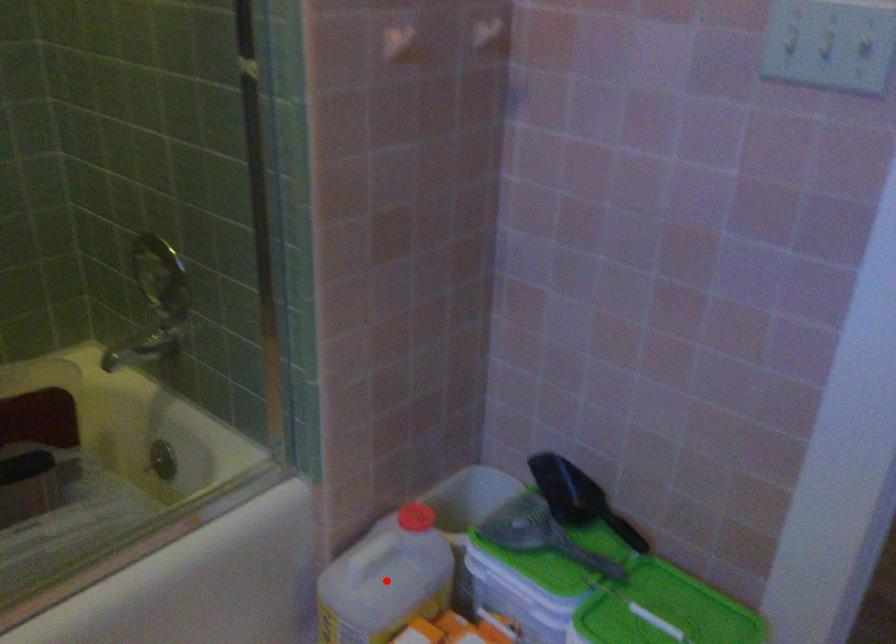
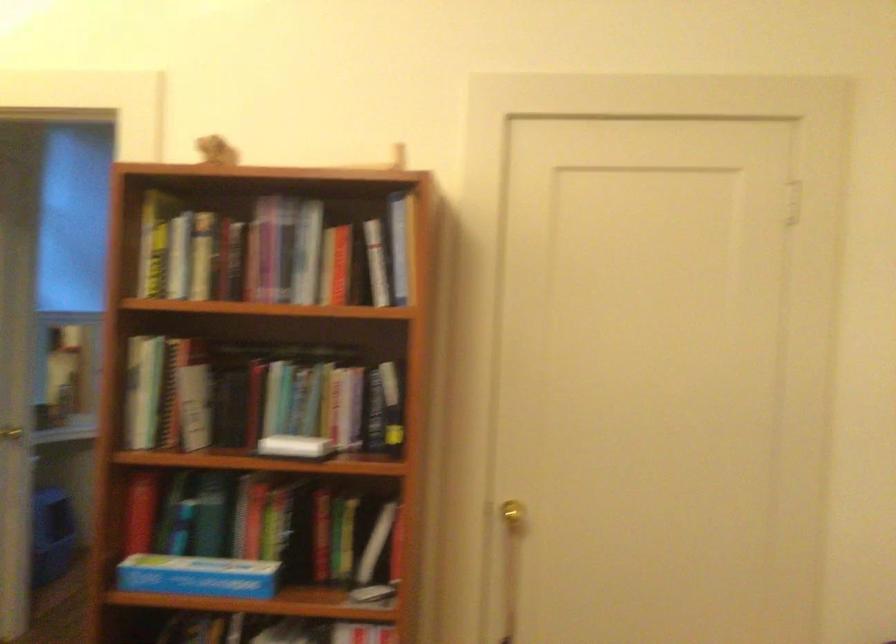
Question: I am providing you with two images of the same scene from different viewpoints. A red point is marked on the first image. At the location where the point appears in image 1, is it still visible in image 2?

Choices:
 (A) Yes
 (B) No

Answer: (B)